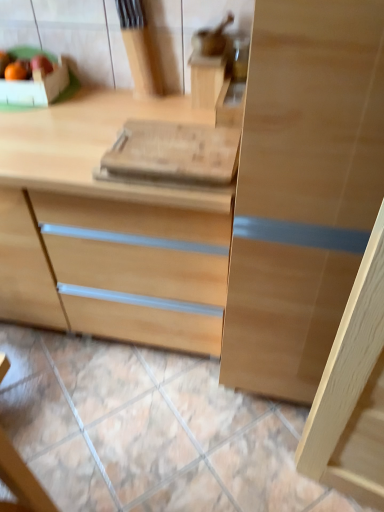
You are a GUI agent. You are given a task and a screenshot of the screen. Output one action in this format:
    pyautogui.click(x=<x>, y=<y>)
    Task: Click on the vacant region above natural wood chest of drawers at center (from a real-world perspective)
    The height and width of the screenshot is (512, 384).
    Given the screenshot: What is the action you would take?
    pyautogui.click(x=78, y=123)